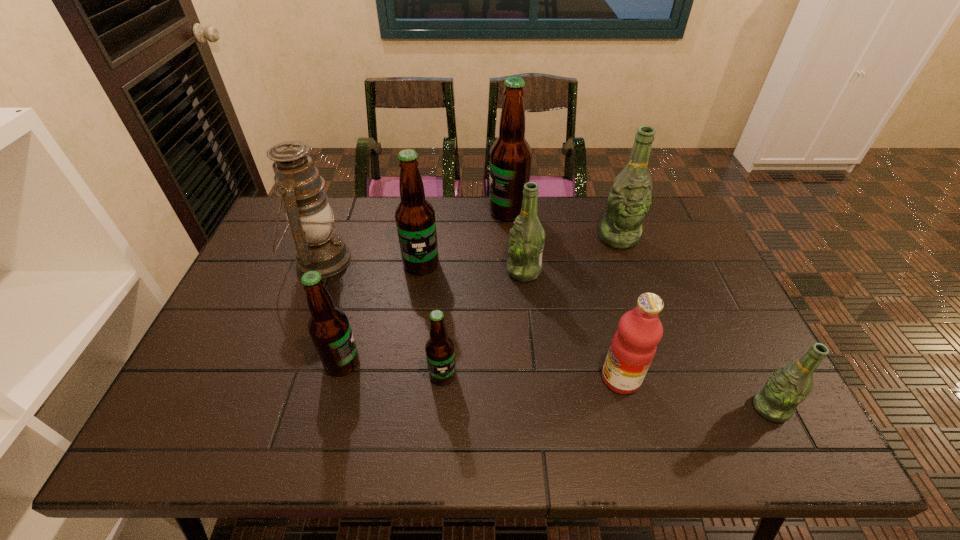
Identify the location of free space located 0.270m on the surface of the biggest green beer bottle. (645, 318).

Image resolution: width=960 pixels, height=540 pixels. In order to click on free space located on the label of the sixth beer bottle from right to left in this screenshot , I will do `click(413, 327)`.

What are the coordinates of `free space located 0.200m on the surface of the second smallest green beer bottle` in the screenshot? It's located at [x=440, y=271].

Locate an element on the screen. The image size is (960, 540). vacant region located 0.150m on the surface of the second smallest green beer bottle is located at coordinates (456, 271).

Where is `vacant space located 0.100m on the surface of the second smallest green beer bottle`? The width and height of the screenshot is (960, 540). vacant space located 0.100m on the surface of the second smallest green beer bottle is located at coordinates (472, 271).

Locate an element on the screen. This screenshot has width=960, height=540. vacant region located 0.340m on the label of the leftmost brown beer bottle is located at coordinates (497, 362).

You are a GUI agent. You are given a task and a screenshot of the screen. Output one action in this format:
    pyautogui.click(x=<x>, y=<y>)
    Task: Click on the free space located on the label of the fruit juice
    
    Given the screenshot: What is the action you would take?
    pyautogui.click(x=505, y=379)

Locate an element on the screen. This screenshot has width=960, height=540. vacant space located 0.140m on the label of the fruit juice is located at coordinates (543, 379).

Where is `vacant space located on the label of the fruit juice`? The image size is (960, 540). vacant space located on the label of the fruit juice is located at coordinates (568, 379).

Where is `vacant space located on the label of the smallest brown beer bottle`? This screenshot has height=540, width=960. vacant space located on the label of the smallest brown beer bottle is located at coordinates (440, 414).